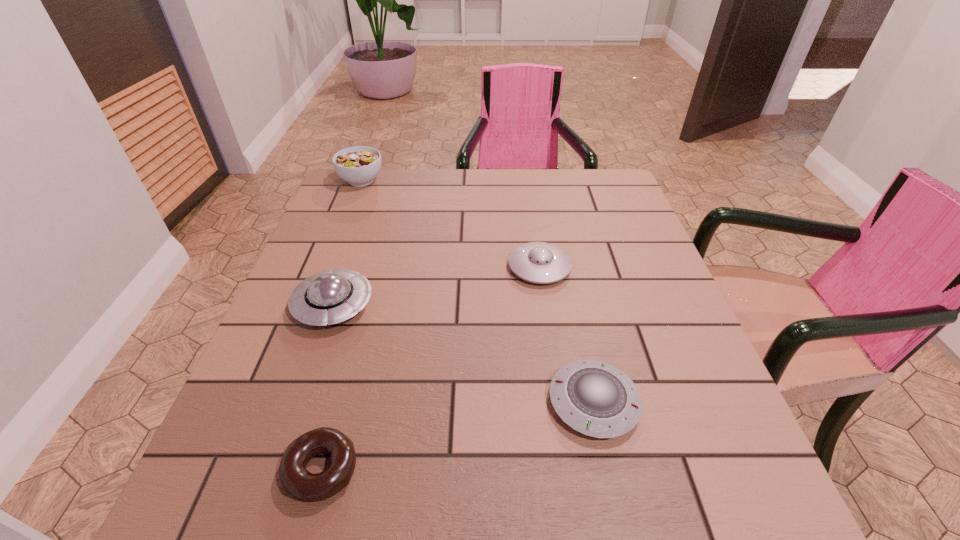
The image size is (960, 540). I want to click on free space at the far left corner, so click(x=388, y=178).

In the image, there is a desktop. In order to click on blank space at the far right corner in this screenshot , I will do `click(595, 203)`.

Locate an element on the screen. free space between the nearest saucer and the leftmost saucer is located at coordinates (464, 354).

Find the location of a particular element. The height and width of the screenshot is (540, 960). vacant area that lies between the doughnut and the tallest saucer is located at coordinates (327, 388).

The image size is (960, 540). I want to click on empty space that is in between the nearest saucer and the soup bowl, so click(x=477, y=291).

Identify the location of free point between the doughnut and the farthest object. (341, 325).

Locate an element on the screen. The width and height of the screenshot is (960, 540). object that is the third closest one to the tallest saucer is located at coordinates (594, 398).

Locate which object is the closest to the tallest saucer. Please provide its 2D coordinates. Your answer should be formatted as a tuple, i.e. [(x, y)], where the tuple contains the x and y coordinates of a point satisfying the conditions above.

[(295, 480)]

Identify the location of the second closest saucer relative to the soup bowl. The width and height of the screenshot is (960, 540). (538, 262).

Image resolution: width=960 pixels, height=540 pixels. In order to click on saucer that is the third nearest to the doughnut in this screenshot , I will do 538,262.